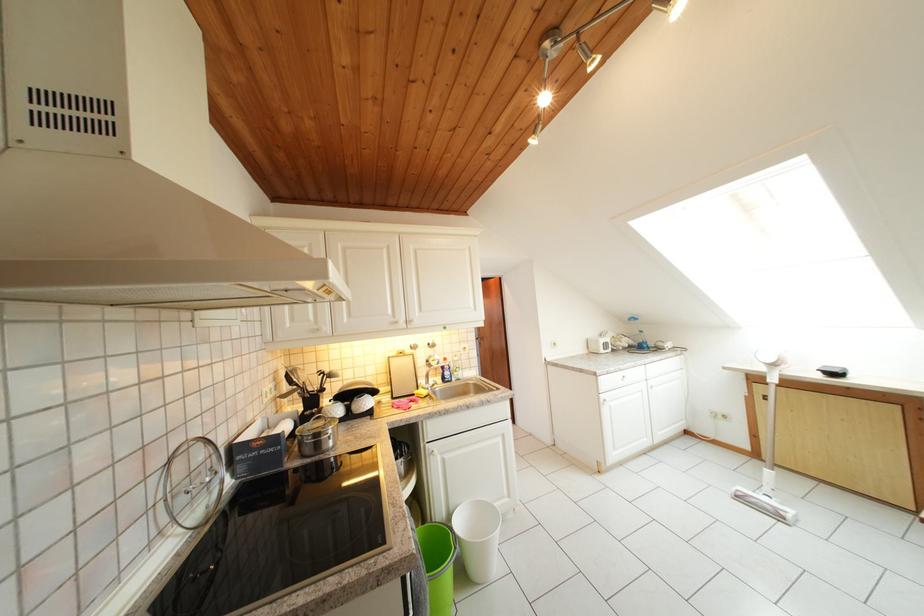
The width and height of the screenshot is (924, 616). What do you see at coordinates (438, 565) in the screenshot? I see `a green plastic bucket` at bounding box center [438, 565].